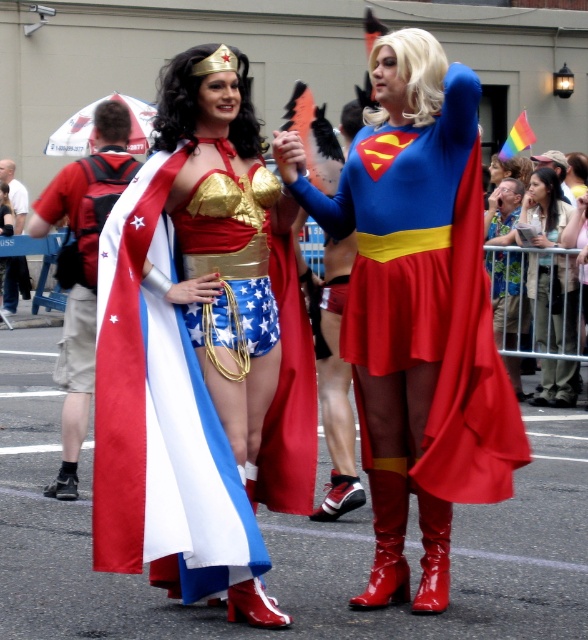
Can you confirm if shiny metallic boots at center is bigger than shiny metallic boots at lower center?

Yes, shiny metallic boots at center is bigger than shiny metallic boots at lower center.

Is point (109, 560) closer to viewer compared to point (2, 312)?

Yes, point (109, 560) is closer to viewer.

At what (x,y) coordinates should I click in order to perform the action: click on shiny metallic boots at center. Please return your answer as a coordinate pair (x, y). This screenshot has height=640, width=588. Looking at the image, I should click on (189, 346).

Between shiny red boots at center and shiny metallic boots at lower center, which one appears on the right side from the viewer's perspective?

shiny red boots at center

Does shiny red boots at center have a greater width compared to shiny metallic boots at lower center?

No.

Which is in front, point (576, 205) or point (8, 202)?

Positioned in front is point (576, 205).

Where is `shiny red boots at center`? The height and width of the screenshot is (640, 588). shiny red boots at center is located at coordinates (579, 244).

Can you confirm if shiny metallic boots at center is bigger than matte black hair at upper right?

Yes.

Is point (166, 358) positioned after point (552, 173)?

That is False.

Between point (223, 122) and point (567, 365), which one is positioned behind?

Point (567, 365)

Image resolution: width=588 pixels, height=640 pixels. Find the location of `shiny metallic boots at center`. shiny metallic boots at center is located at coordinates (189, 346).